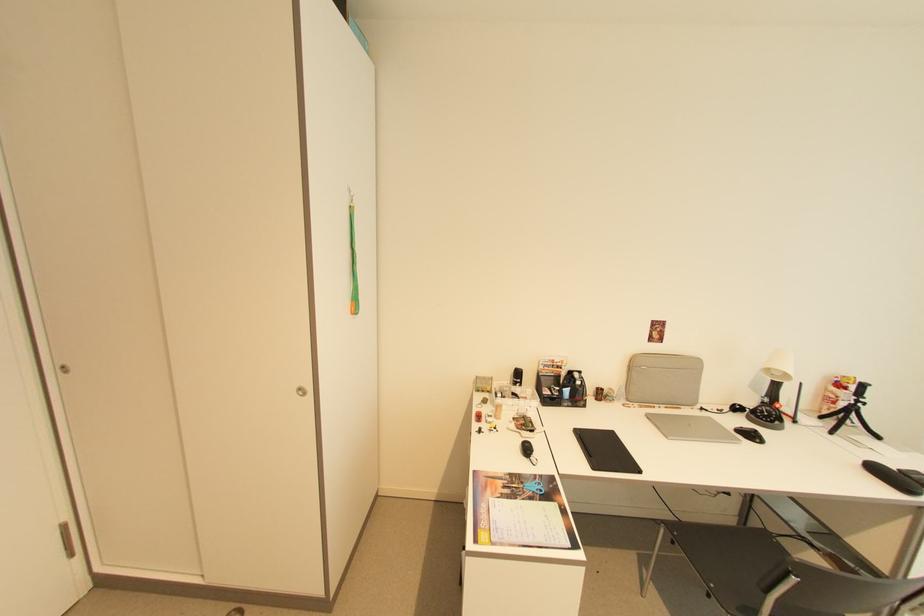
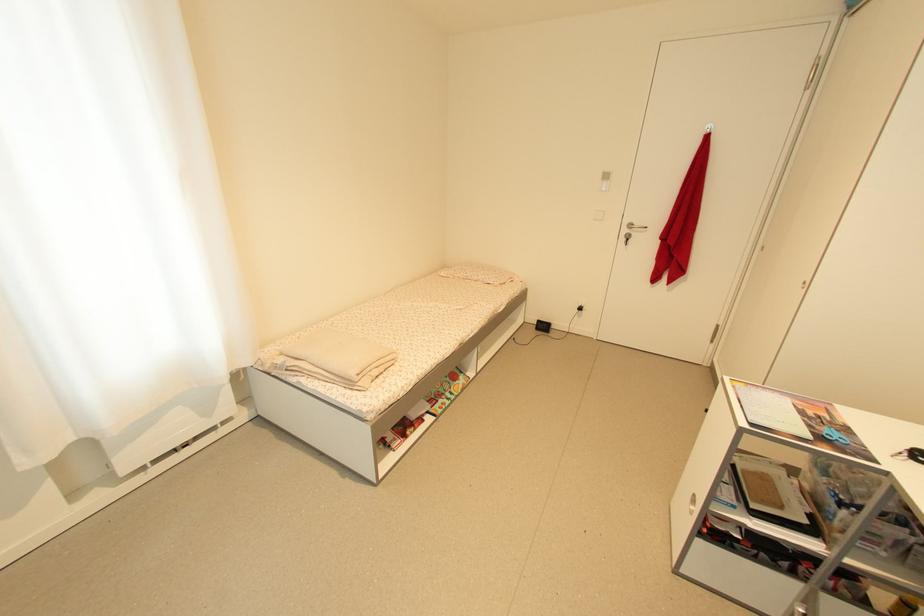
In the second image, find the point that corresponds to (533,495) in the first image.

(822, 429)